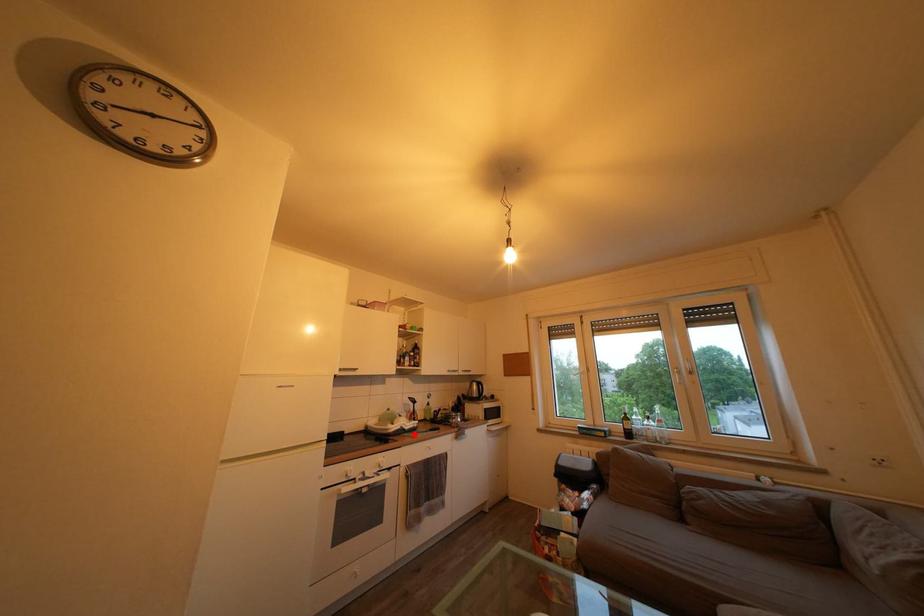
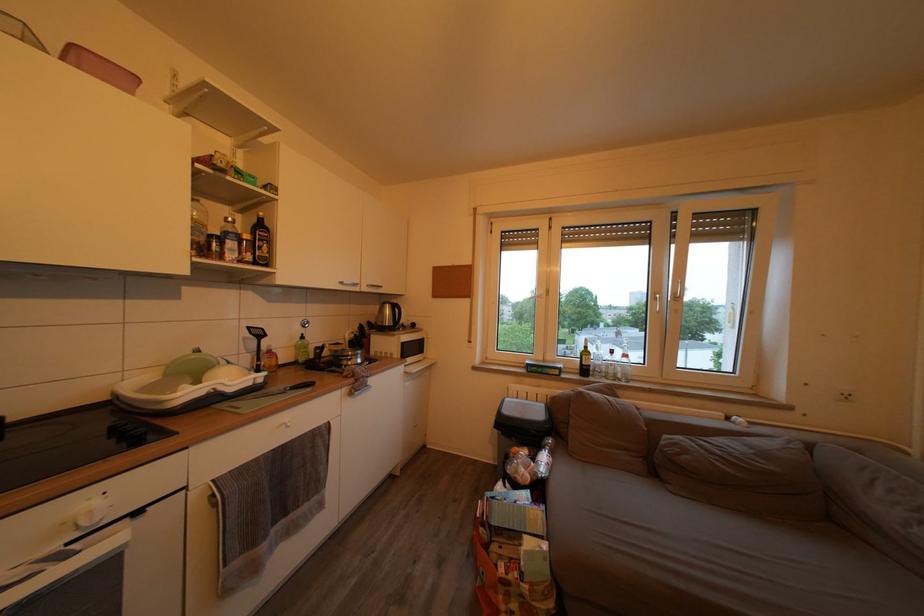
Question: I am providing you with two images of the same scene from different viewpoints. In image1, a red point is highlighted. Considering the same 3D point in image2, which of the following is correct?

Choices:
 (A) It is closer
 (B) It is farther

Answer: (A)